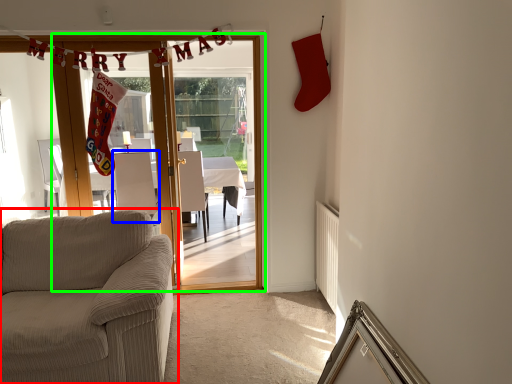
Question: Which object is the farthest from studio couch (highlighted by a red box)? Choose among these: armchair (highlighted by a blue box) or door (highlighted by a green box).

Choices:
 (A) armchair
 (B) door

Answer: (A)